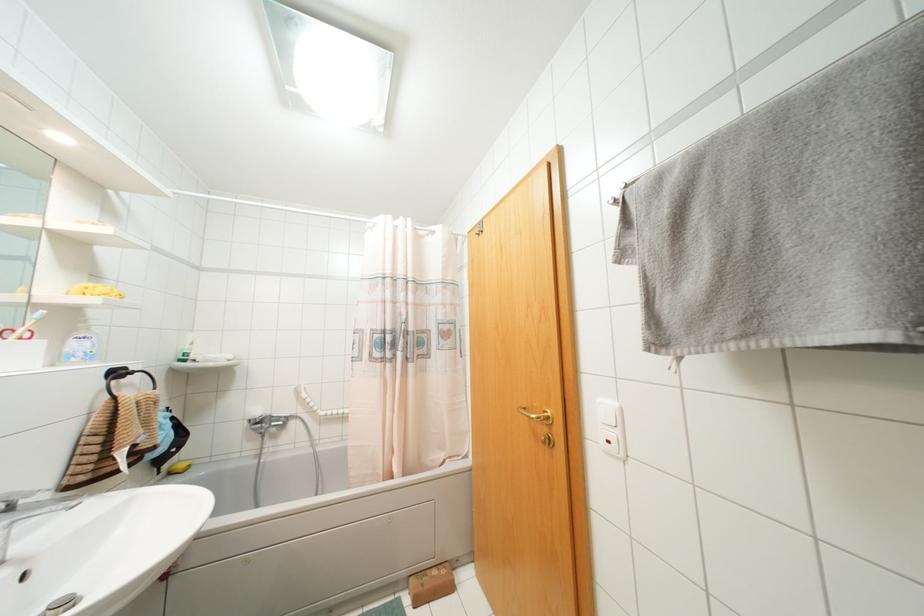
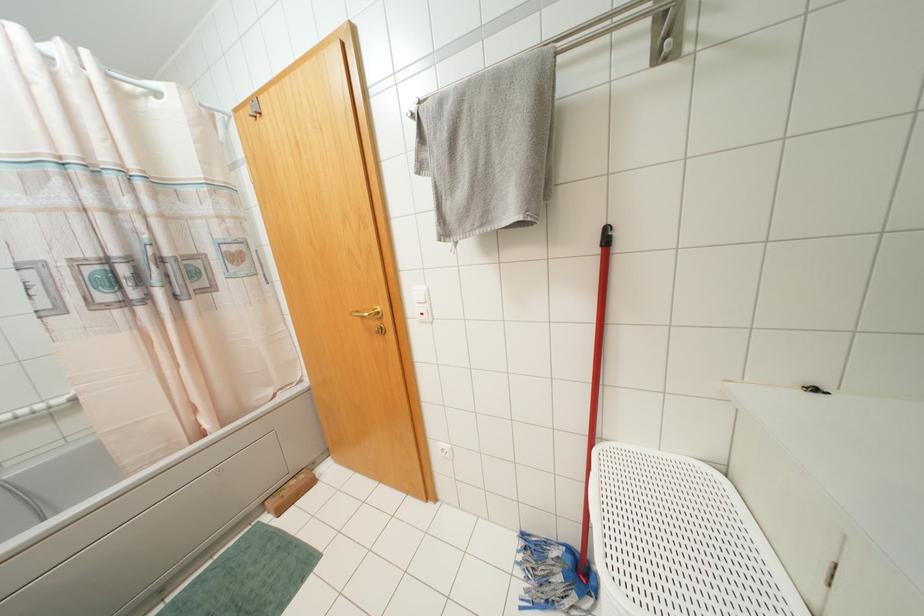
The point at (621, 408) is marked in the first image. Where is the corresponding point in the second image?

(428, 290)